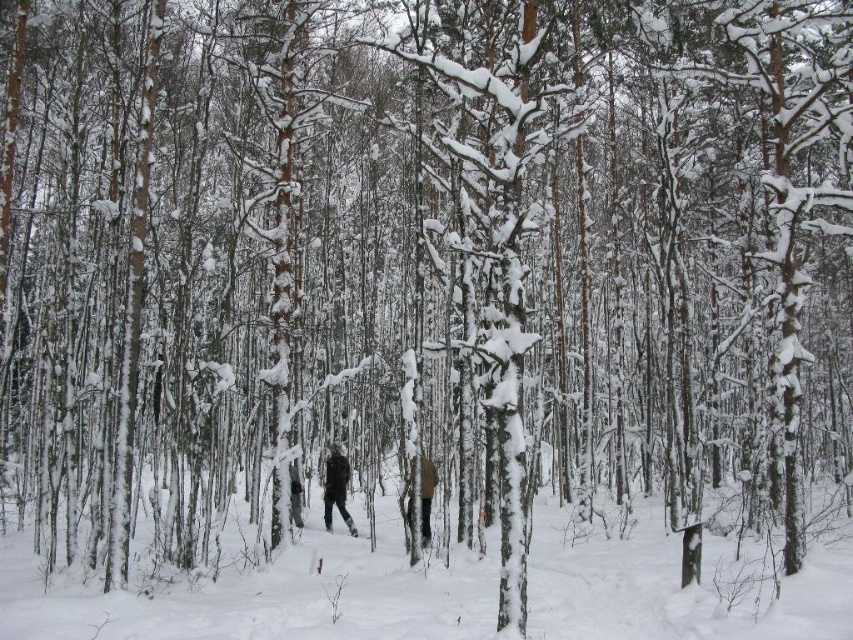
Question: Which point is farther from the camera taking this photo?

Choices:
 (A) (107, 625)
 (B) (425, 484)
 (C) (340, 449)

Answer: (C)

Question: Which of the following is the closest to the observer?

Choices:
 (A) (637, 570)
 (B) (323, 499)

Answer: (A)

Question: Can you confirm if white powdery snow at center is positioned to the right of brown woolen jacket at center?

Choices:
 (A) no
 (B) yes

Answer: (B)

Question: Is white powdery snow at center positioned before brown woolen jacket at center?

Choices:
 (A) no
 (B) yes

Answer: (B)

Question: Which point appears farthest from the camera in this image?

Choices:
 (A) (329, 451)
 (B) (628, 589)

Answer: (A)

Question: Does dark gray ski suit at center have a lesser width compared to brown woolen jacket at center?

Choices:
 (A) no
 (B) yes

Answer: (A)